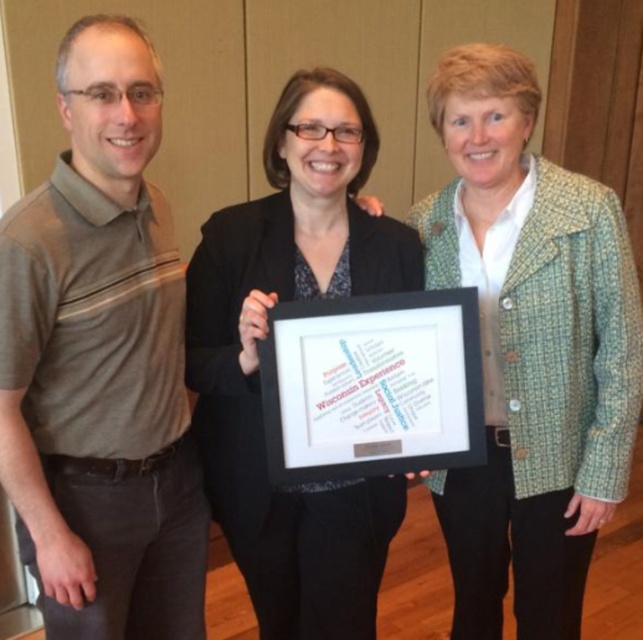
Who is shorter, green tweed blazer at center or black fabric at center?

black fabric at center is shorter.

Can you confirm if green tweed blazer at center is wider than black fabric at center?

No.

Describe the element at coordinates (529, 349) in the screenshot. This screenshot has width=643, height=640. I see `green tweed blazer at center` at that location.

The width and height of the screenshot is (643, 640). In order to click on green tweed blazer at center in this screenshot , I will do `click(529, 349)`.

Does gray striped polo shirt at left lie in front of green tweed blazer at center?

Yes, it is.

Is point (51, 468) behind point (547, 589)?

No, it is in front of (547, 589).

The width and height of the screenshot is (643, 640). I want to click on gray striped polo shirt at left, so click(102, 362).

Is gray striped polo shirt at left wider than black fabric at center?

Incorrect, gray striped polo shirt at left's width does not surpass black fabric at center's.

You are a GUI agent. You are given a task and a screenshot of the screen. Output one action in this format:
    pyautogui.click(x=<x>, y=<y>)
    Task: Click on the gray striped polo shirt at left
    The image size is (643, 640).
    Given the screenshot: What is the action you would take?
    (x=102, y=362)

What do you see at coordinates (102, 362) in the screenshot? This screenshot has height=640, width=643. I see `gray striped polo shirt at left` at bounding box center [102, 362].

I want to click on gray striped polo shirt at left, so click(x=102, y=362).